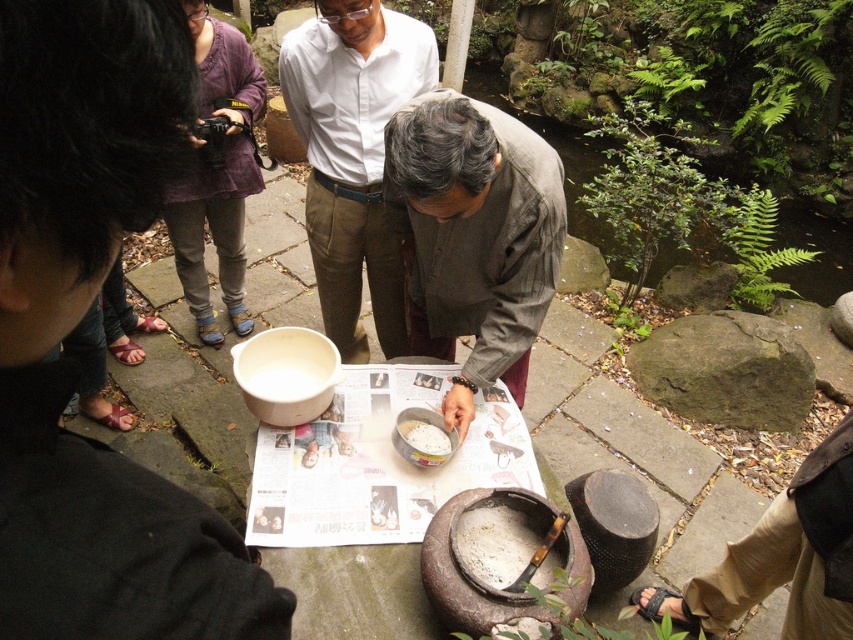
Does newspaper paper at center have a lesser height compared to white matte bowl at center?

No, newspaper paper at center is not shorter than white matte bowl at center.

Between newspaper paper at center and white matte bowl at center, which one appears on the right side from the viewer's perspective?

white matte bowl at center

Measure the distance between newspaper paper at center and camera.

newspaper paper at center is 1.34 meters away from camera.

Locate an element on the screen. Image resolution: width=853 pixels, height=640 pixels. newspaper paper at center is located at coordinates click(373, 499).

Who is taller, gray woolen sweater at center or light brown cotton shirt at center?

light brown cotton shirt at center

Is point (442, 106) positioned before point (350, 40)?

That is True.

Find the location of `gray woolen sweater at center`. gray woolen sweater at center is located at coordinates (474, 236).

From the picture: Is gray woolen sweater at center wider than green leafy plant at upper right?

Yes.

Who is more distant from viewer, (538,145) or (486,84)?

The point (486,84) is behind.

Is point (440, 268) positioned after point (569, 136)?

No, (440, 268) is closer to viewer.

Where is `gray woolen sweater at center`? This screenshot has width=853, height=640. gray woolen sweater at center is located at coordinates (474, 236).